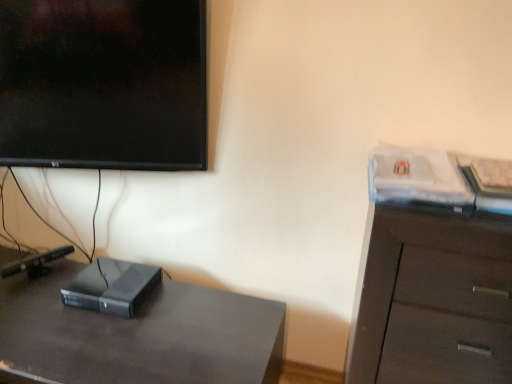
Question: Is black matte computer at lower left shorter than dark wood cabinet at right?

Choices:
 (A) no
 (B) yes

Answer: (B)

Question: Is black matte computer at lower left thinner than dark wood cabinet at right?

Choices:
 (A) yes
 (B) no

Answer: (A)

Question: Can you confirm if black matte computer at lower left is bigger than dark wood cabinet at right?

Choices:
 (A) no
 (B) yes

Answer: (A)

Question: Is black matte computer at lower left not within dark wood cabinet at right?

Choices:
 (A) yes
 (B) no

Answer: (A)

Question: Can dark wood cabinet at right be found inside black matte computer at lower left?

Choices:
 (A) yes
 (B) no

Answer: (B)

Question: Which is correct: dark wood cabinet at right is inside black matte computer at lower left, or outside of it?

Choices:
 (A) outside
 (B) inside

Answer: (A)

Question: Relative to black matte computer at lower left, is dark wood cabinet at right in front or behind?

Choices:
 (A) behind
 (B) front

Answer: (B)

Question: In terms of height, does dark wood cabinet at right look taller or shorter compared to black matte computer at lower left?

Choices:
 (A) short
 (B) tall

Answer: (B)

Question: Is dark wood cabinet at right to the left or to the right of black matte computer at lower left in the image?

Choices:
 (A) right
 (B) left

Answer: (A)

Question: Relative to black matte desk at lower left, is black matte computer at lower left in front or behind?

Choices:
 (A) front
 (B) behind

Answer: (B)

Question: Would you say black matte computer at lower left is to the left or to the right of black matte desk at lower left in the picture?

Choices:
 (A) left
 (B) right

Answer: (B)

Question: Is black matte computer at lower left bigger or smaller than black matte desk at lower left?

Choices:
 (A) big
 (B) small

Answer: (B)

Question: Is black matte computer at lower left inside or outside of black matte desk at lower left?

Choices:
 (A) outside
 (B) inside

Answer: (A)

Question: From a real-world perspective, is black matte computer at lower left above or below dark wood cabinet at right?

Choices:
 (A) below
 (B) above

Answer: (A)

Question: In the image, is black matte computer at lower left positioned in front of or behind dark wood cabinet at right?

Choices:
 (A) behind
 (B) front

Answer: (A)